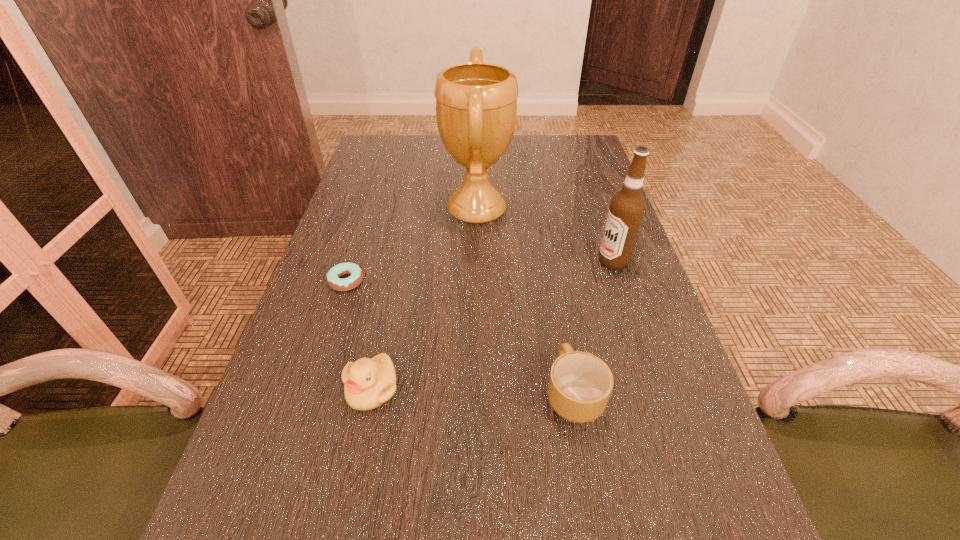
Locate an element on the screen. mug that is at the right edge is located at coordinates (580, 385).

I want to click on vacant space at the left edge of the desktop, so click(x=367, y=193).

The width and height of the screenshot is (960, 540). Find the location of `vacant region at the right edge`. vacant region at the right edge is located at coordinates (594, 298).

At what (x,y) coordinates should I click in order to perform the action: click on free space at the far left corner of the desktop. Please return your answer as a coordinate pair (x, y). Looking at the image, I should click on (393, 165).

What are the coordinates of `free space at the far right corner of the desktop` in the screenshot? It's located at (557, 140).

You are a GUI agent. You are given a task and a screenshot of the screen. Output one action in this format:
    pyautogui.click(x=<x>, y=<y>)
    Task: Click on the empty location between the alcohol and the award
    The width and height of the screenshot is (960, 540).
    Given the screenshot: What is the action you would take?
    pyautogui.click(x=545, y=235)

What are the coordinates of `vacant space that's between the fourth object from left to right and the doughnut` in the screenshot? It's located at (460, 338).

Image resolution: width=960 pixels, height=540 pixels. Find the location of `vacant space in between the doughnut and the fourth object from right to left`. vacant space in between the doughnut and the fourth object from right to left is located at coordinates point(359,335).

This screenshot has height=540, width=960. In order to click on empty space between the alcohol and the duckling in this screenshot , I will do `click(492, 325)`.

The width and height of the screenshot is (960, 540). I want to click on free space between the duckling and the leftmost object, so click(x=359, y=335).